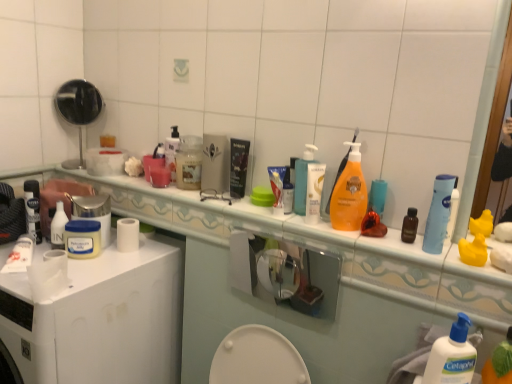
I want to click on vacant region in front of matte black tube at center, so click(249, 209).